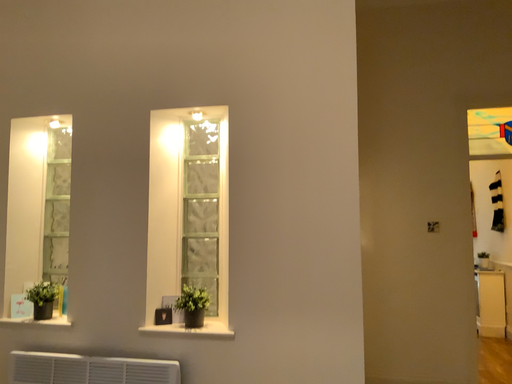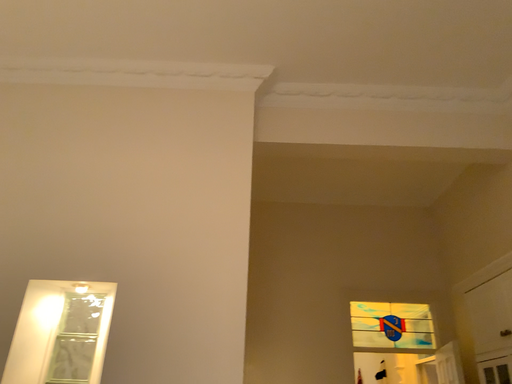
Question: Which way did the camera rotate in the video?

Choices:
 (A) rotated downward
 (B) rotated upward

Answer: (B)